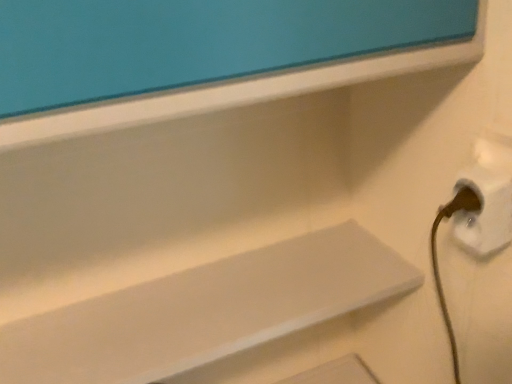
The height and width of the screenshot is (384, 512). What do you see at coordinates (205, 311) in the screenshot? I see `white matte shelf at center` at bounding box center [205, 311].

Identify the location of white matte shelf at center. The image size is (512, 384). (205, 311).

The height and width of the screenshot is (384, 512). Describe the element at coordinates (483, 211) in the screenshot. I see `white plastic electric outlet at lower right` at that location.

What is the approximate width of white plastic electric outlet at lower right?

white plastic electric outlet at lower right is 4.42 centimeters in width.

Find the location of a particular element. The width and height of the screenshot is (512, 384). white plastic electric outlet at lower right is located at coordinates (483, 211).

Locate an element on the screen. This screenshot has width=512, height=384. white matte shelf at center is located at coordinates (205, 311).

Is white matte shelf at center at the right side of white plastic electric outlet at lower right?

In fact, white matte shelf at center is to the left of white plastic electric outlet at lower right.

Which object is closer to the camera taking this photo, white matte shelf at center or white plastic electric outlet at lower right?

Positioned in front is white plastic electric outlet at lower right.

Does point (220, 302) come in front of point (474, 251)?

No, (220, 302) is behind (474, 251).

From the image's perspective, between white matte shelf at center and white plastic electric outlet at lower right, which one is located above?

From the image's view, white plastic electric outlet at lower right is above.

From a real-world perspective, who is located higher, white matte shelf at center or white plastic electric outlet at lower right?

white plastic electric outlet at lower right, from a real-world perspective.

Between white matte shelf at center and white plastic electric outlet at lower right, which one has smaller width?

white plastic electric outlet at lower right.

Is white matte shelf at center taller than white plastic electric outlet at lower right?

No, white matte shelf at center is not taller than white plastic electric outlet at lower right.

Is white matte shelf at center smaller than white plastic electric outlet at lower right?

Actually, white matte shelf at center might be larger than white plastic electric outlet at lower right.

Would you say white matte shelf at center contains white plastic electric outlet at lower right?

No, white matte shelf at center does not contain white plastic electric outlet at lower right.

Is the surface of white matte shelf at center in direct contact with white plastic electric outlet at lower right?

No, white matte shelf at center is not in contact with white plastic electric outlet at lower right.

Is white matte shelf at center positioned with its back to white plastic electric outlet at lower right?

No, white matte shelf at center is not facing away from white plastic electric outlet at lower right.

How different are the orientations of white matte shelf at center and white plastic electric outlet at lower right in degrees?

There is a 90.1-degree angle between the facing directions of white matte shelf at center and white plastic electric outlet at lower right.

Image resolution: width=512 pixels, height=384 pixels. Identify the location of electric outlet located above the white matte shelf at center (from the image's perspective). (483, 211).

Considering the relative positions of white plastic electric outlet at lower right and white matte shelf at center in the image provided, is white plastic electric outlet at lower right to the left of white matte shelf at center from the viewer's perspective?

No.

Is white plastic electric outlet at lower right positioned in front of white matte shelf at center?

Yes, the depth of white plastic electric outlet at lower right is less than that of white matte shelf at center.

Does point (486, 176) come behind point (195, 334)?

That is False.

From the image's perspective, does white plastic electric outlet at lower right appear lower than white matte shelf at center?

Incorrect, from the image's perspective, white plastic electric outlet at lower right is higher than white matte shelf at center.

In the scene shown: From a real-world perspective, is white plastic electric outlet at lower right located higher than white matte shelf at center?

Yes, from a real-world perspective, white plastic electric outlet at lower right is above white matte shelf at center.

Can you confirm if white plastic electric outlet at lower right is thinner than white matte shelf at center?

Yes, white plastic electric outlet at lower right is thinner than white matte shelf at center.

Considering the sizes of white plastic electric outlet at lower right and white matte shelf at center in the image, is white plastic electric outlet at lower right taller or shorter than white matte shelf at center?

In the image, white plastic electric outlet at lower right appears to be taller than white matte shelf at center.

Who is bigger, white plastic electric outlet at lower right or white matte shelf at center?

white matte shelf at center is bigger.

Based on the photo, would you say white plastic electric outlet at lower right is inside or outside white matte shelf at center?

white plastic electric outlet at lower right is not enclosed by white matte shelf at center.

Are white plastic electric outlet at lower right and white matte shelf at center far apart?

That's not correct — white plastic electric outlet at lower right is a little close to white matte shelf at center.

Could you tell me if white plastic electric outlet at lower right is turned towards white matte shelf at center?

No, white plastic electric outlet at lower right is not oriented towards white matte shelf at center.

Can you tell me how much white plastic electric outlet at lower right and white matte shelf at center differ in facing direction?

90.1 degrees.

In the scene shown: How much distance is there between white plastic electric outlet at lower right and white matte shelf at center?

13.00 inches.

You are a GUI agent. You are given a task and a screenshot of the screen. Output one action in this format:
    pyautogui.click(x=<x>, y=<y>)
    Task: Click on the electric outlet in front of the white matte shelf at center
    
    Given the screenshot: What is the action you would take?
    pyautogui.click(x=483, y=211)

Find the location of a particular element. electric outlet in front of the white matte shelf at center is located at coordinates (483, 211).

This screenshot has width=512, height=384. Identify the location of electric outlet above the white matte shelf at center (from a real-world perspective). (483, 211).